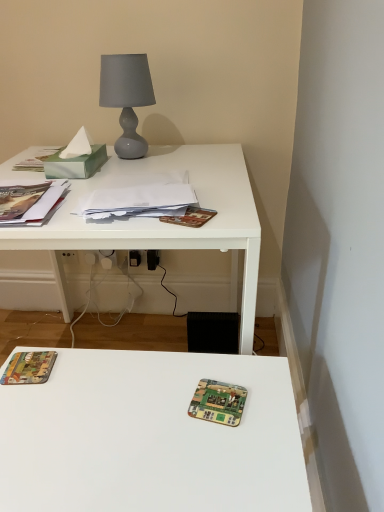
Question: Is white matte desk at upper left oriented away from matte gray glass lamp at upper center?

Choices:
 (A) yes
 (B) no

Answer: (B)

Question: From the image's perspective, is white matte desk at upper left located beneath matte gray glass lamp at upper center?

Choices:
 (A) no
 (B) yes

Answer: (B)

Question: Is matte gray glass lamp at upper center completely or partially inside white matte desk at upper left?

Choices:
 (A) yes
 (B) no

Answer: (B)

Question: Does white matte desk at upper left have a greater height compared to matte gray glass lamp at upper center?

Choices:
 (A) no
 (B) yes

Answer: (B)

Question: Can you confirm if white matte desk at upper left is shorter than matte gray glass lamp at upper center?

Choices:
 (A) no
 (B) yes

Answer: (A)

Question: Could you tell me if white matte desk at upper left is facing matte gray glass lamp at upper center?

Choices:
 (A) yes
 (B) no

Answer: (B)

Question: Is hardcover book at lower left, the 2th paperback book when ordered from top to bottom, touching green circuit board at center?

Choices:
 (A) yes
 (B) no

Answer: (B)

Question: From a real-world perspective, is hardcover book at lower left, the 2th paperback book when ordered from top to bottom, on top of green circuit board at center?

Choices:
 (A) yes
 (B) no

Answer: (A)

Question: Can green circuit board at center be found inside hardcover book at lower left, positioned as the first paperback book in bottom-to-top order?

Choices:
 (A) no
 (B) yes

Answer: (A)

Question: Is hardcover book at lower left, positioned as the first paperback book in bottom-to-top order, facing towards green circuit board at center?

Choices:
 (A) no
 (B) yes

Answer: (A)

Question: From a real-world perspective, is hardcover book at lower left, positioned as the first paperback book in bottom-to-top order, physically below green circuit board at center?

Choices:
 (A) no
 (B) yes

Answer: (A)

Question: From the image's perspective, is hardcover book at lower left, the second paperback book in the right-to-left sequence, beneath green circuit board at center?

Choices:
 (A) no
 (B) yes

Answer: (A)

Question: Is white matte desk at upper left to the right of white paper stack at center from the viewer's perspective?

Choices:
 (A) no
 (B) yes

Answer: (A)